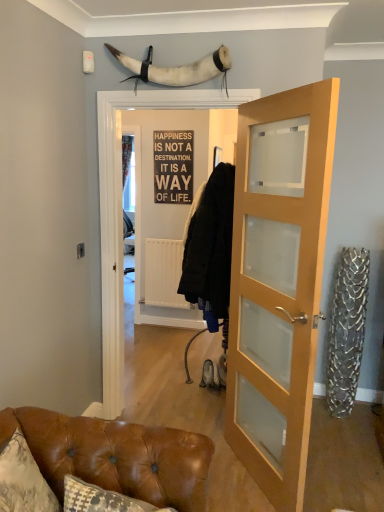
Question: Is metallic sign at center behind brown leather couch at lower left?

Choices:
 (A) yes
 (B) no

Answer: (A)

Question: Would you say metallic sign at center contains brown leather couch at lower left?

Choices:
 (A) no
 (B) yes

Answer: (A)

Question: Could you tell me if metallic sign at center is facing brown leather couch at lower left?

Choices:
 (A) no
 (B) yes

Answer: (B)

Question: From a real-world perspective, does metallic sign at center stand above brown leather couch at lower left?

Choices:
 (A) no
 (B) yes

Answer: (B)

Question: Can you confirm if metallic sign at center is taller than brown leather couch at lower left?

Choices:
 (A) yes
 (B) no

Answer: (A)

Question: Based on their positions, is metallic sign at center located to the left or right of brown leather couch at lower left?

Choices:
 (A) right
 (B) left

Answer: (A)

Question: Looking at their shapes, would you say metallic sign at center is wider or thinner than brown leather couch at lower left?

Choices:
 (A) wide
 (B) thin

Answer: (B)

Question: From the image's perspective, is metallic sign at center positioned above or below brown leather couch at lower left?

Choices:
 (A) below
 (B) above

Answer: (B)

Question: From a real-world perspective, relative to brown leather couch at lower left, is metallic sign at center vertically above or below?

Choices:
 (A) below
 (B) above

Answer: (B)

Question: Is light wood/glass door at center inside the boundaries of brown leather couch at lower left, or outside?

Choices:
 (A) inside
 (B) outside

Answer: (B)

Question: Considering the positions of light wood/glass door at center and brown leather couch at lower left in the image, is light wood/glass door at center bigger or smaller than brown leather couch at lower left?

Choices:
 (A) small
 (B) big

Answer: (B)

Question: Relative to brown leather couch at lower left, is light wood/glass door at center in front or behind?

Choices:
 (A) behind
 (B) front

Answer: (A)

Question: Does point (296, 227) appear closer or farther from the camera than point (89, 422)?

Choices:
 (A) farther
 (B) closer

Answer: (A)

Question: Based on their sizes in the image, would you say brown leather couch at lower left is bigger or smaller than light wood/glass door at center?

Choices:
 (A) big
 (B) small

Answer: (B)

Question: Considering their positions, is brown leather couch at lower left located in front of or behind light wood/glass door at center?

Choices:
 (A) front
 (B) behind

Answer: (A)